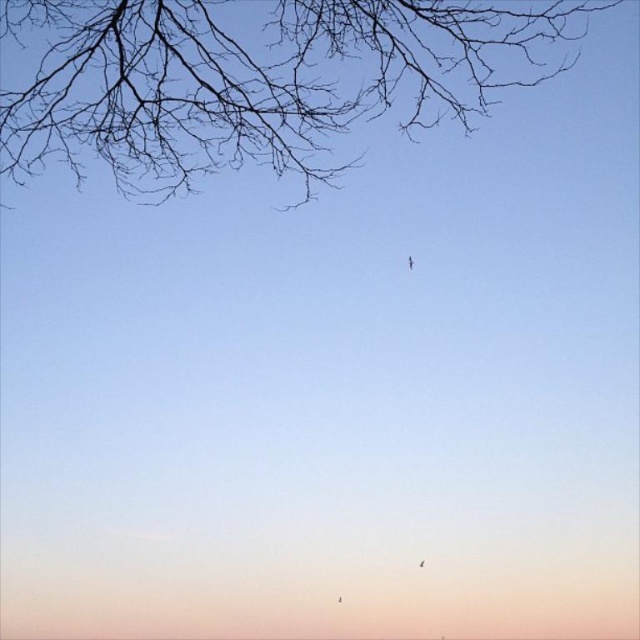
You are flying a kite in the sky and see the brown branches at upper left and the transparent plastic kite at center. Which object is located higher in the sky?

The brown branches at upper left are located higher in the sky than the transparent plastic kite at center.

You are standing in the middle of a field looking at the sky scene. There are two points marked in the image, point (22, 156) and point (410, 260). Which point is closer to you?

Point (22, 156) is further to the camera than point (410, 260), so the point closer to you is point (410, 260).